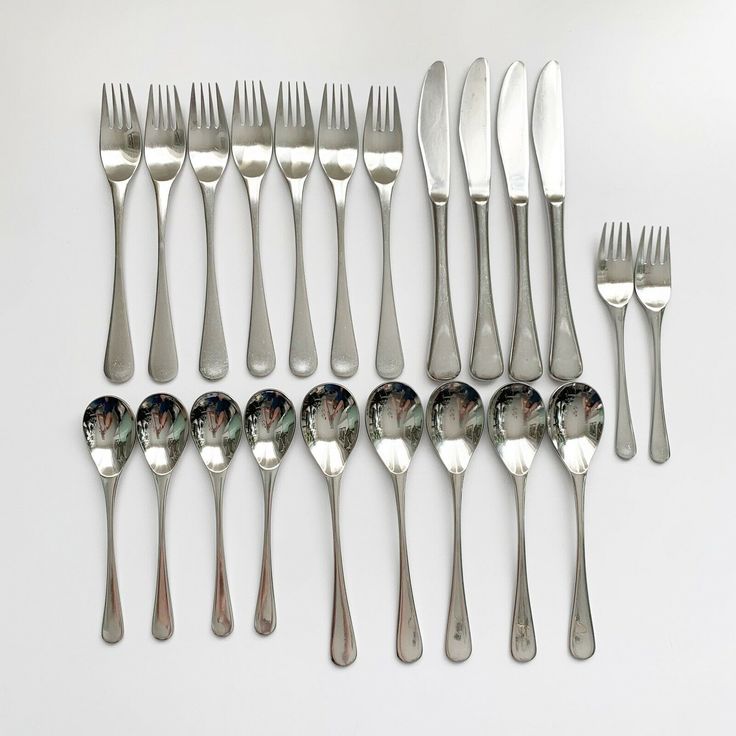
Identify the location of spoons. The height and width of the screenshot is (736, 736). (109, 456), (155, 450), (212, 436), (271, 434), (324, 431), (396, 424), (459, 421), (531, 417), (589, 425).